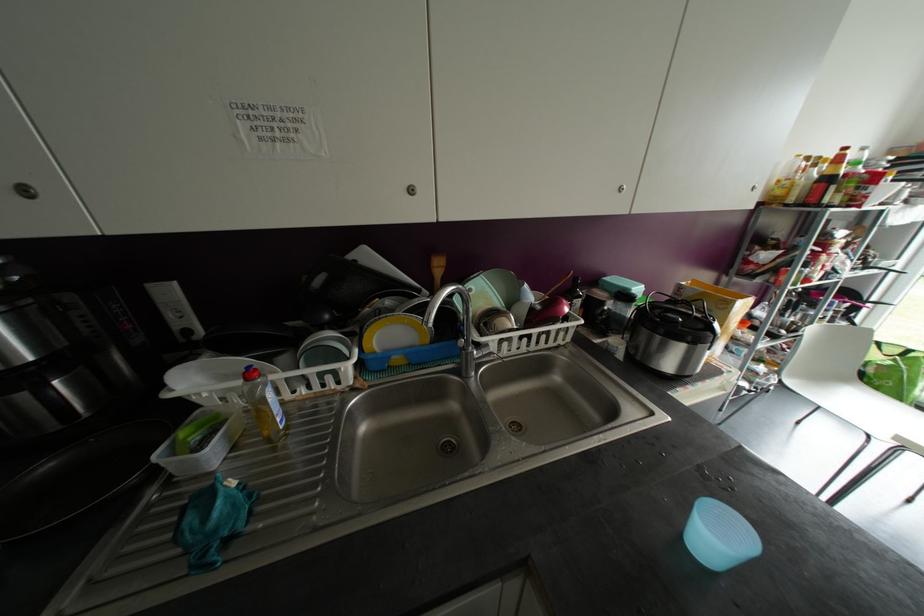
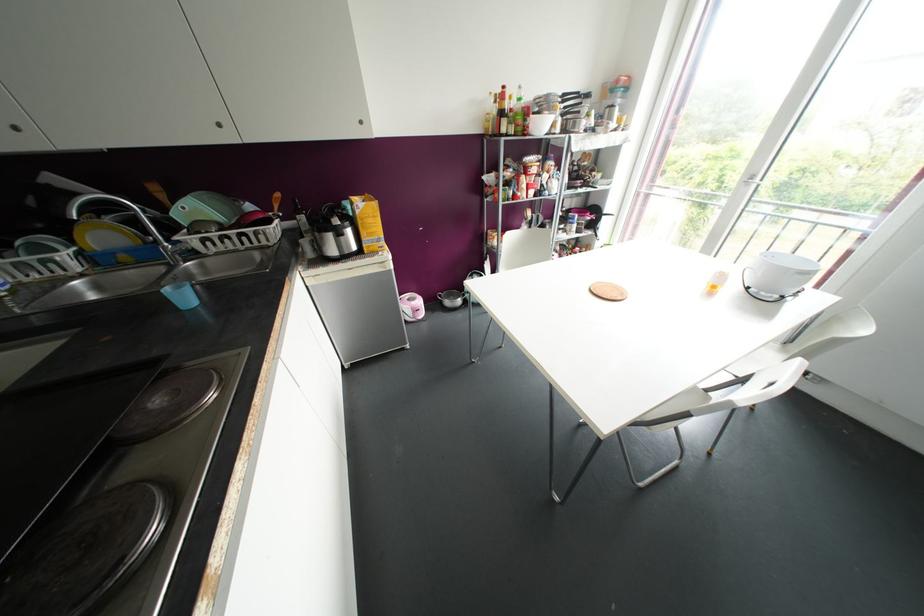
In the second image, find the point that corresponds to (565,310) in the first image.

(257, 217)